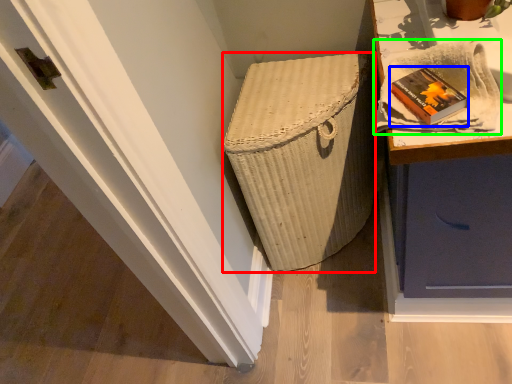
Question: Which is farther away from basket container (highlighted by a red box)? book (highlighted by a blue box) or cloth (highlighted by a green box)?

Choices:
 (A) book
 (B) cloth

Answer: (A)